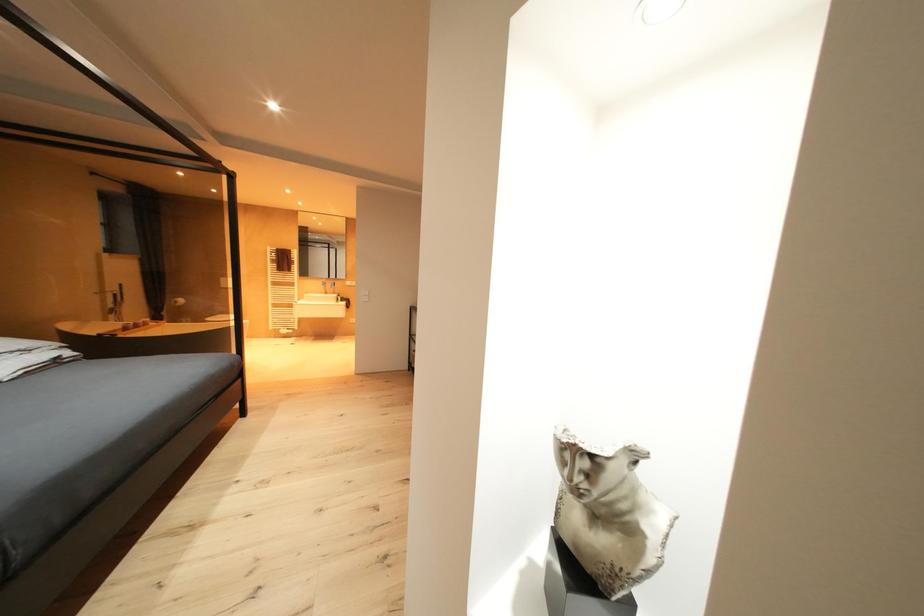
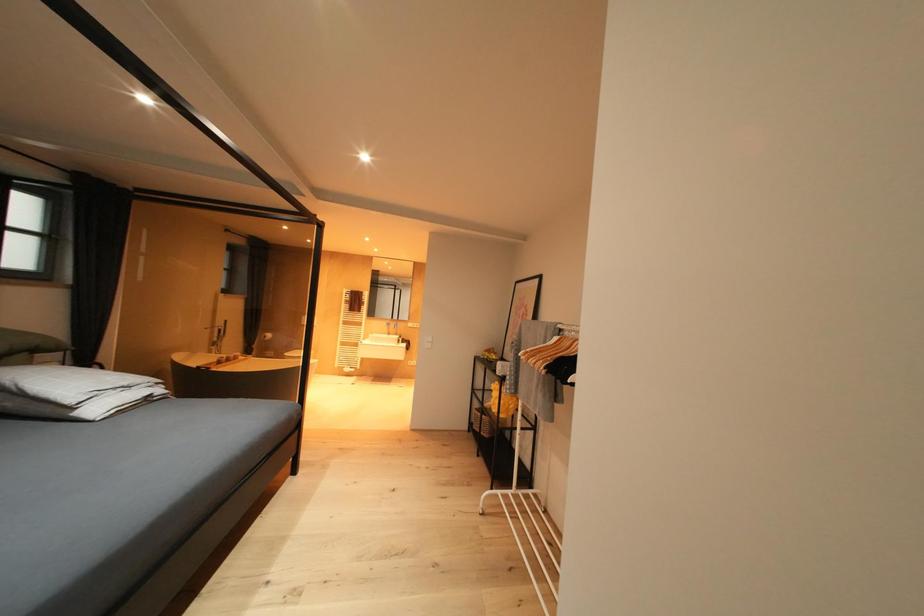
Question: The first image is from the beginning of the video and the second image is from the end. How did the camera likely rotate when shooting the video?

Choices:
 (A) Left
 (B) Right
 (C) Up
 (D) Down

Answer: (A)